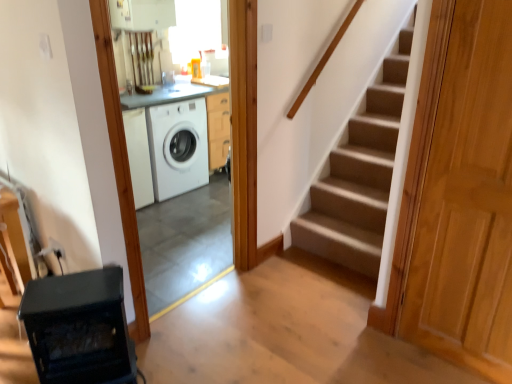
Where is `free space in front of white glossy washing machine at center`? free space in front of white glossy washing machine at center is located at coordinates (214, 342).